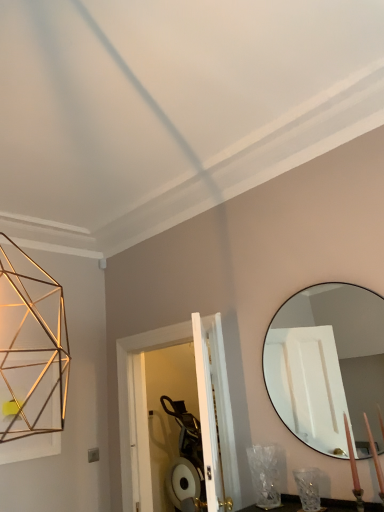
Find the location of a particular element. This screenshot has height=512, width=384. candle at lower right is located at coordinates (375, 458).

What do you see at coordinates (328, 366) in the screenshot? I see `matte black mirror at right` at bounding box center [328, 366].

Where is `clear glass vase at lower right`? Image resolution: width=384 pixels, height=512 pixels. clear glass vase at lower right is located at coordinates (308, 488).

Is clear glass vase at lower right at the right side of candle at lower right?

No, clear glass vase at lower right is not to the right of candle at lower right.

Based on the photo, is clear glass vase at lower right positioned with its back to candle at lower right?

No, clear glass vase at lower right is not facing the opposite direction of candle at lower right.

From the image's perspective, is clear glass vase at lower right beneath candle at lower right?

Yes, from the image's perspective, clear glass vase at lower right is below candle at lower right.

Is matte black mirror at right spatially inside candle at lower right, or outside of it?

matte black mirror at right is spatially situated outside candle at lower right.

Is matte black mirror at right far from candle at lower right?

matte black mirror at right is near candle at lower right, not far away.

Image resolution: width=384 pixels, height=512 pixels. In order to click on mirror behind the candle at lower right in this screenshot , I will do pyautogui.click(x=328, y=366).

Between clear glass vase at lower right and matte black mirror at right, which one is positioned in front?

matte black mirror at right is more forward.

How far apart are clear glass vase at lower right and matte black mirror at right?

clear glass vase at lower right is 62.11 centimeters from matte black mirror at right.

Is clear glass vase at lower right to the left of matte black mirror at right from the viewer's perspective?

Yes.

From a real-world perspective, who is located lower, clear glass vase at lower right or matte black mirror at right?

From a 3D spatial view, clear glass vase at lower right is below.

From a real-world perspective, which is physically above, matte black mirror at right or clear glass vase at lower right?

matte black mirror at right is physically above.

How different are the orientations of matte black mirror at right and clear glass vase at lower right in degrees?

1.36 degrees.

Considering the sizes of matte black mirror at right and clear glass vase at lower right in the image, is matte black mirror at right taller or shorter than clear glass vase at lower right?

Considering their sizes, matte black mirror at right has more height than clear glass vase at lower right.

The width and height of the screenshot is (384, 512). I want to click on table lamp behind the matte black mirror at right, so click(308, 488).

Considering the sizes of candle at lower right and clear glass vase at lower right in the image, is candle at lower right bigger or smaller than clear glass vase at lower right?

candle at lower right is smaller than clear glass vase at lower right.

Visually, is candle at lower right positioned to the left or to the right of clear glass vase at lower right?

From the image, it's evident that candle at lower right is to the right of clear glass vase at lower right.

Locate an element on the screen. This screenshot has width=384, height=512. table lamp below the candle at lower right (from the image's perspective) is located at coordinates (308, 488).

In terms of width, does candle at lower right look wider or thinner when compared to clear glass vase at lower right?

Clearly, candle at lower right has less width compared to clear glass vase at lower right.

Can you confirm if candle at lower right is bigger than matte black mirror at right?

No, candle at lower right is not bigger than matte black mirror at right.

Which object is wider, candle at lower right or matte black mirror at right?

candle at lower right is wider.

Who is shorter, candle at lower right or matte black mirror at right?

Standing shorter between the two is candle at lower right.

Where is `candle in front of the clear glass vase at lower right`? candle in front of the clear glass vase at lower right is located at coordinates (375, 458).

I want to click on mirror lying behind the candle at lower right, so click(328, 366).

When comparing their distances from candle at lower right, does clear glass vase at lower right or matte black mirror at right seem closer?

The object closer to candle at lower right is clear glass vase at lower right.

Looking at the image, which one is located further to matte black mirror at right, clear glass vase at lower right or candle at lower right?

Among the two, candle at lower right is located further to matte black mirror at right.

Looking at the image, which one is located closer to clear glass vase at lower right, candle at lower right or matte black mirror at right?

Among the two, candle at lower right is located nearer to clear glass vase at lower right.

Which object lies further to the anchor point clear glass vase at lower right, matte black mirror at right or candle at lower right?

Among the two, matte black mirror at right is located further to clear glass vase at lower right.

Estimate the real-world distances between objects in this image. Which object is closer to candle at lower right, matte black mirror at right or clear glass vase at lower right?

clear glass vase at lower right is positioned closer to the anchor candle at lower right.

Considering their positions, is candle at lower right positioned further to matte black mirror at right than clear glass vase at lower right?

candle at lower right is positioned further to the anchor matte black mirror at right.

Identify the location of candle between matte black mirror at right and clear glass vase at lower right vertically. The image size is (384, 512). (375, 458).